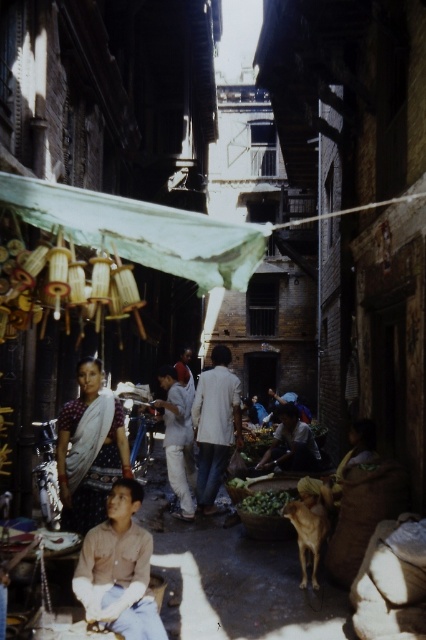
Question: Which point is closer to the camera taking this photo?

Choices:
 (A) (181, 456)
 (B) (284, 490)
 (C) (308, 506)

Answer: (C)

Question: Can you confirm if brown furry dog at center is thinner than green leafy vegetables at center?

Choices:
 (A) no
 (B) yes

Answer: (B)

Question: Where is light beige fabric coat at center located in relation to green leafy vegetables at center in the image?

Choices:
 (A) above
 (B) below

Answer: (A)

Question: Which object is the closest to the brown cotton shirt at lower left?

Choices:
 (A) light brown cotton shirt at center
 (B) light blue fabric shirt at center
 (C) brown furry dog at center
 (D) green leafy vegetables at center

Answer: (C)

Question: Which is nearer to the dark brown fabric at center?

Choices:
 (A) brown furry dog at center
 (B) green leafy vegetables at center

Answer: (B)

Question: Does brown cotton shirt at lower left appear under dark brown fabric at center?

Choices:
 (A) yes
 (B) no

Answer: (B)